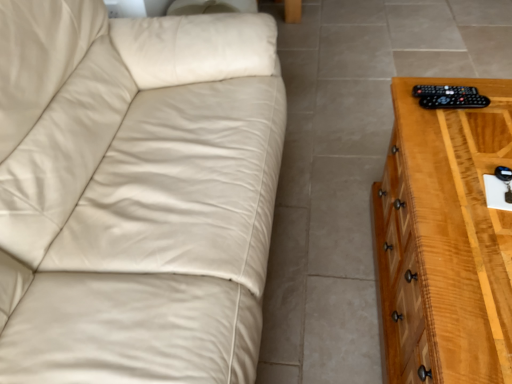
Describe the element at coordinates (443, 90) in the screenshot. The image size is (512, 384). I see `black plastic remote at right` at that location.

Locate an element on the screen. The height and width of the screenshot is (384, 512). light brown wooden chest of drawers at right is located at coordinates (445, 239).

Is black plastic remote at right wider than black plastic remote at right?

Incorrect, the width of black plastic remote at right does not surpass that of black plastic remote at right.

Which object is closer to the camera, black plastic remote at right or black plastic remote at right?

black plastic remote at right is more forward.

From a real-world perspective, is black plastic remote at right positioned above or below black plastic remote at right?

Clearly, from a real-world perspective, black plastic remote at right is below black plastic remote at right.

Which point is more forward, (416, 94) or (426, 98)?

The point (426, 98) is more forward.

Considering the relative sizes of light brown wooden chest of drawers at right and black plastic remote at right in the image provided, is light brown wooden chest of drawers at right shorter than black plastic remote at right?

In fact, light brown wooden chest of drawers at right may be taller than black plastic remote at right.

Based on the photo, could you tell me if light brown wooden chest of drawers at right is facing black plastic remote at right?

No.

From a real-world perspective, is light brown wooden chest of drawers at right above or below black plastic remote at right?

light brown wooden chest of drawers at right is situated lower than black plastic remote at right in the real world.

From the image's perspective, which one is positioned higher, light brown wooden chest of drawers at right or black plastic remote at right?

black plastic remote at right is shown above in the image.

Can you confirm if black plastic remote at right is shorter than light brown wooden chest of drawers at right?

Indeed, black plastic remote at right has a lesser height compared to light brown wooden chest of drawers at right.

In the scene shown: From the image's perspective, is black plastic remote at right beneath light brown wooden chest of drawers at right?

No, from the image's perspective, black plastic remote at right is not beneath light brown wooden chest of drawers at right.

Considering the sizes of objects black plastic remote at right and light brown wooden chest of drawers at right in the image provided, who is bigger, black plastic remote at right or light brown wooden chest of drawers at right?

light brown wooden chest of drawers at right.

What's the angular difference between black plastic remote at right and light brown wooden chest of drawers at right's facing directions?

black plastic remote at right and light brown wooden chest of drawers at right are facing 1.54 degrees away from each other.

From the picture: Considering the relative sizes of light brown wooden chest of drawers at right and black plastic remote at right in the image provided, is light brown wooden chest of drawers at right taller than black plastic remote at right?

Correct, light brown wooden chest of drawers at right is much taller as black plastic remote at right.

From the picture: Is light brown wooden chest of drawers at right facing towards black plastic remote at right?

No, light brown wooden chest of drawers at right is not facing towards black plastic remote at right.

Does point (488, 124) come closer to viewer compared to point (464, 91)?

Yes, point (488, 124) is in front of point (464, 91).

This screenshot has height=384, width=512. Identify the location of the chest of drawers in front of the black plastic remote at right. (445, 239).

From the picture: Who is bigger, black plastic remote at right or black plastic remote at right?

Bigger between the two is black plastic remote at right.

Is black plastic remote at right inside or outside of black plastic remote at right?

black plastic remote at right exists outside the volume of black plastic remote at right.

Does black plastic remote at right touch black plastic remote at right?

Absolutely, black plastic remote at right is next to and touching black plastic remote at right.

The image size is (512, 384). I want to click on control in front of the black plastic remote at right, so click(x=449, y=97).

Considering the positions of point (436, 88) and point (388, 241), is point (436, 88) closer or farther from the camera than point (388, 241)?

Point (436, 88).

Consider the image. Which is more to the right, black plastic remote at right or light brown wooden chest of drawers at right?

light brown wooden chest of drawers at right is more to the right.

From the image's perspective, is black plastic remote at right above or below light brown wooden chest of drawers at right?

From the image's perspective, black plastic remote at right appears above light brown wooden chest of drawers at right.

Considering the relative sizes of black plastic remote at right and light brown wooden chest of drawers at right in the image provided, is black plastic remote at right smaller than light brown wooden chest of drawers at right?

Yes.

Locate an element on the screen. The height and width of the screenshot is (384, 512). remote directly beneath the black plastic remote at right (from a real-world perspective) is located at coordinates (443, 90).

Find the location of a particular element. The height and width of the screenshot is (384, 512). chest of drawers on the right side of black plastic remote at right is located at coordinates (445, 239).

When comparing their distances from light brown wooden chest of drawers at right, does black plastic remote at right or black plastic remote at right seem further?

Among the two, black plastic remote at right is located further to light brown wooden chest of drawers at right.

Estimate the real-world distances between objects in this image. Which object is further from black plastic remote at right, black plastic remote at right or light brown wooden chest of drawers at right?

light brown wooden chest of drawers at right is positioned further to the anchor black plastic remote at right.

Which object lies nearer to the anchor point black plastic remote at right, light brown wooden chest of drawers at right or black plastic remote at right?

black plastic remote at right.

Based on their spatial positions, is black plastic remote at right or black plastic remote at right closer to light brown wooden chest of drawers at right?

black plastic remote at right.

Considering their positions, is light brown wooden chest of drawers at right positioned further to black plastic remote at right than black plastic remote at right?

light brown wooden chest of drawers at right.

Considering their positions, is black plastic remote at right positioned further to black plastic remote at right than light brown wooden chest of drawers at right?

light brown wooden chest of drawers at right is further to black plastic remote at right.

In order to click on control between light brown wooden chest of drawers at right and black plastic remote at right along the z-axis in this screenshot , I will do `click(449, 97)`.